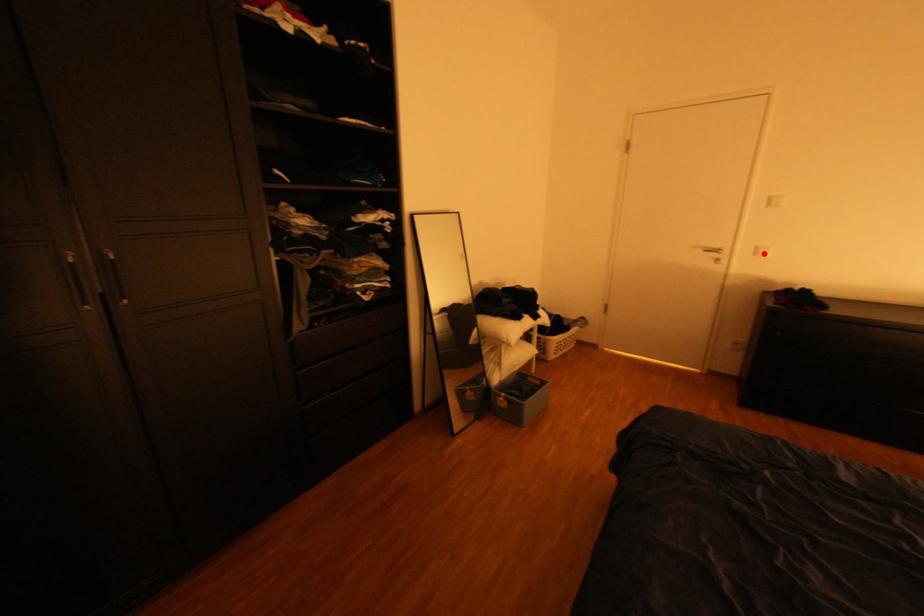
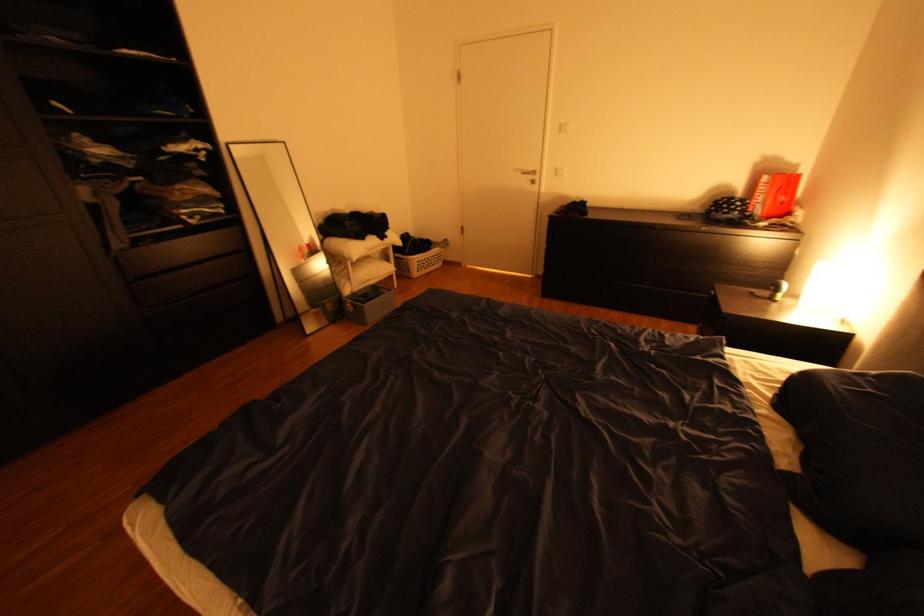
Find the pixel in the second image that matches the highlighted location in the first image.

(565, 174)